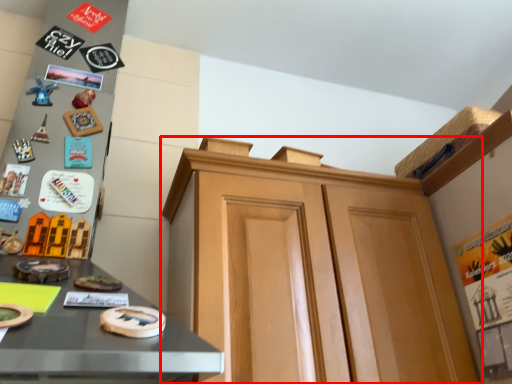
Question: From the image, what is the correct spatial relationship of cabinetry (annotated by the red box) in relation to toy?

Choices:
 (A) right
 (B) left

Answer: (A)